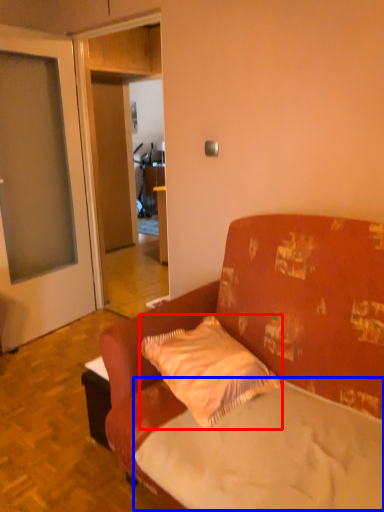
Question: Which object appears farthest to the camera in this image, pillow (highlighted by a red box) or mattress (highlighted by a blue box)?

Choices:
 (A) pillow
 (B) mattress

Answer: (A)